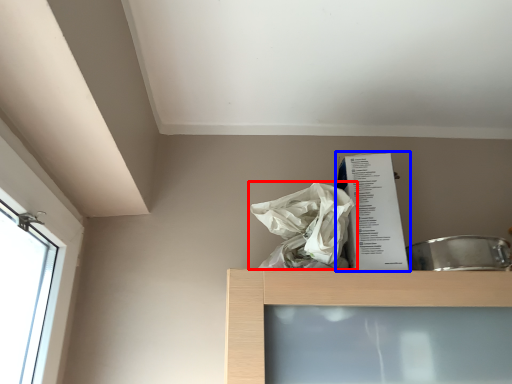
Question: Which object is further to the camera taking this photo, plastic bag (highlighted by a red box) or paperback book (highlighted by a blue box)?

Choices:
 (A) plastic bag
 (B) paperback book

Answer: (B)